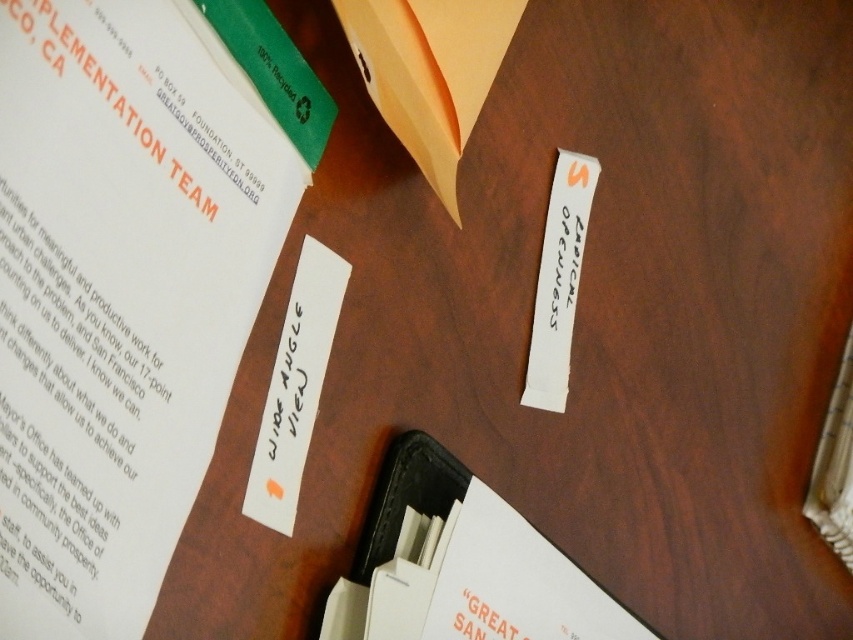
You are standing 30 inches away from a wooden desk. A point on the desk is located at coordinates point (460, 628). Can you reach that point without moving closer to the desk?

The point (460, 628) is 27.14 inches away from you, so yes, you can reach it without moving closer since it is within your 30 inch reach distance.

You are organizing the items on your desk and notice the black leather binder at lower right and the white matte paper at center. Which item is closer to the edge of the desk?

The black leather binder at lower right is positioned under the white matte paper at center, so the white matte paper at center is closer to the edge of the desk.

You are organizing items on a desk and need to place a new item near the white paper at upper left. Where should you place it to ensure it stays close to the white paper?

The white paper at upper left is located at point (119, 294), so you should place the new item near those coordinates to keep it close.